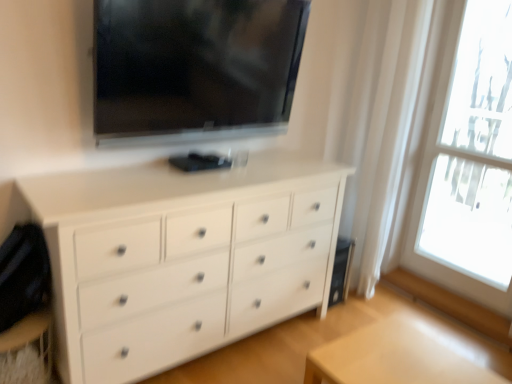
This screenshot has width=512, height=384. I want to click on free point above light wood table at lower right (from a real-world perspective), so click(393, 350).